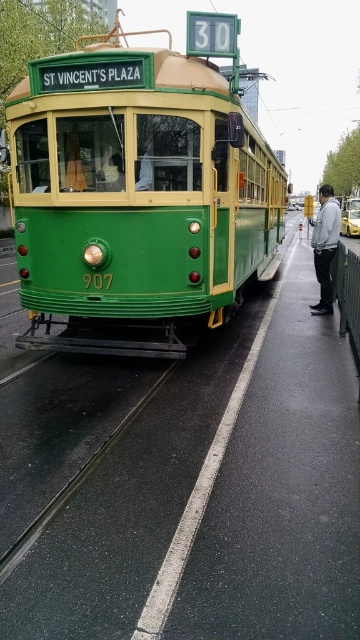
Question: Which point is farther from the camera taking this photo?

Choices:
 (A) (312, 243)
 (B) (345, 230)
 (C) (133, 108)

Answer: (B)

Question: Does gray fabric jacket at center have a lesser width compared to yellow metallic taxi at center?

Choices:
 (A) no
 (B) yes

Answer: (A)

Question: Observing the image, what is the correct spatial positioning of gray fabric jacket at center in reference to yellow metallic taxi at center?

Choices:
 (A) left
 (B) right

Answer: (B)

Question: Among these objects, which one is farthest from the camera?

Choices:
 (A) gray fabric jacket at center
 (B) yellow metallic taxi at center
 (C) green polished tram at center

Answer: (A)

Question: Which point is farther from the camera taking this photo?

Choices:
 (A) (321, 298)
 (B) (163, 298)
 (C) (353, 218)

Answer: (C)

Question: From the image, what is the correct spatial relationship of green polished tram at center in relation to yellow metallic taxi at center?

Choices:
 (A) below
 (B) above

Answer: (B)